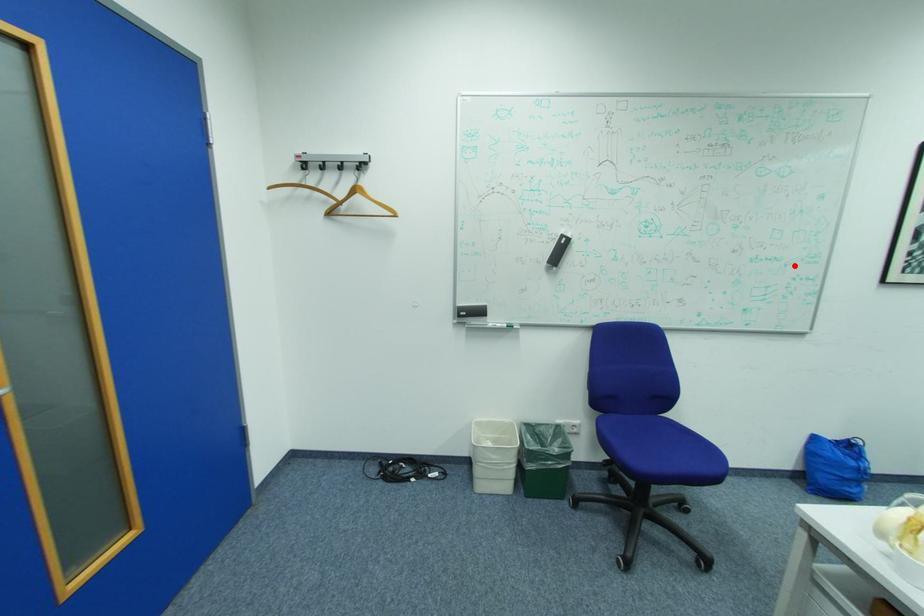
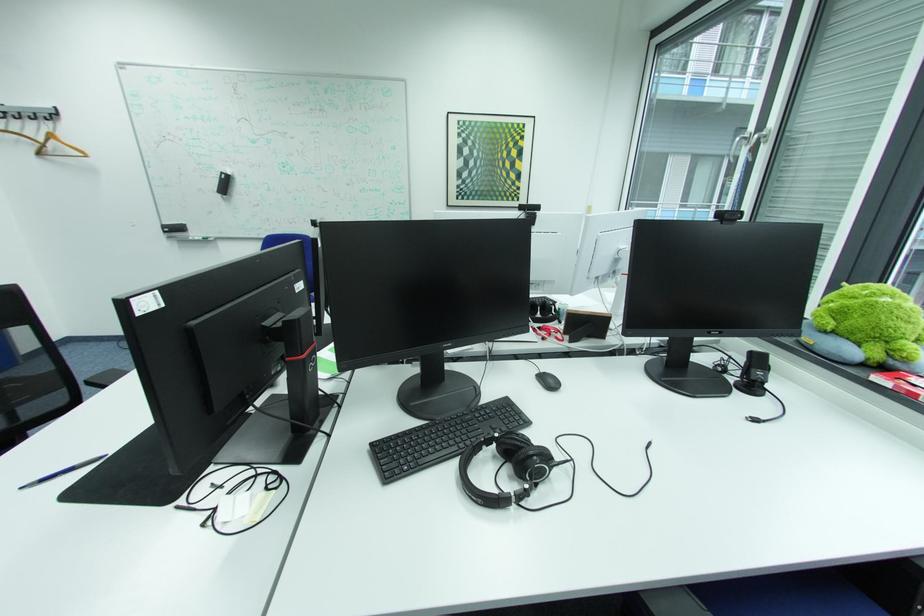
Locate, in the second image, the point that corresponds to the highlighted location in the first image.

(393, 195)